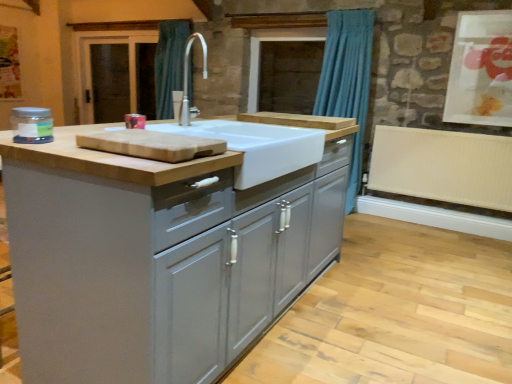
Find the location of `free space above white ribbed radiator at lower right (from a real-world perspective)`. free space above white ribbed radiator at lower right (from a real-world perspective) is located at coordinates (442, 130).